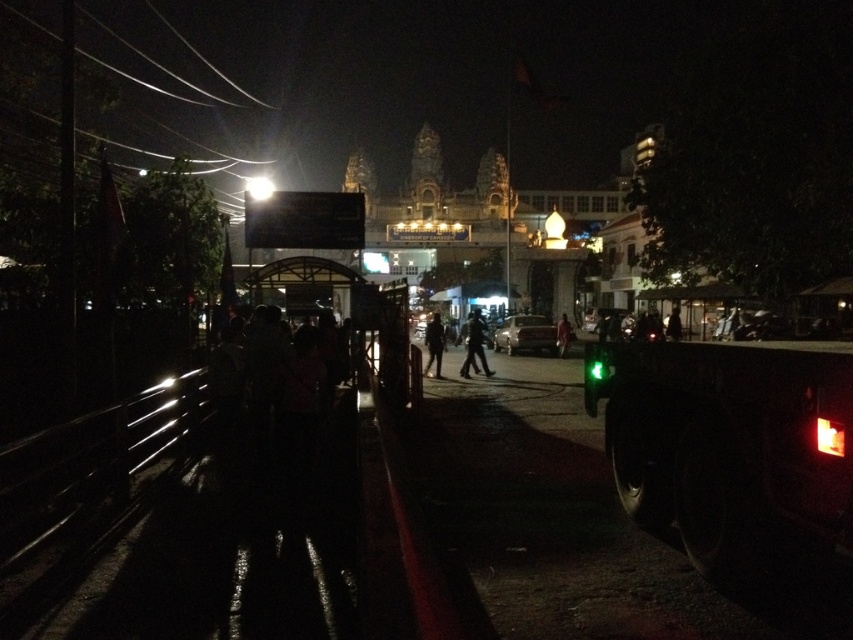
You are a photographer trying to capture the scene of the dark fabric person at center and the red fabric person at center. Which person would appear closer to the camera in your photo?

The dark fabric person at center would appear closer to the camera because objects that are bigger in the image are typically closer to the viewer.

You are a photographer trying to capture a clear shot of the dark fabric person at center and the black matte pants at center. Since the pants are possibly wider than the person, could this affect your photo composition?

The black matte pants at center might be wider than dark fabric person at center, so this could cause the pants to appear larger in the photo, potentially making the composition look unbalanced if not framed carefully.